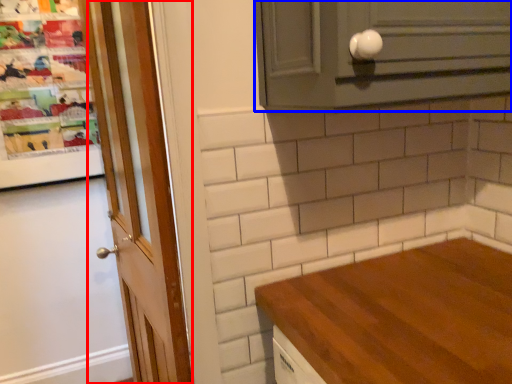
Question: Which object appears farthest to the camera in this image, door (highlighted by a red box) or cabinetry (highlighted by a blue box)?

Choices:
 (A) door
 (B) cabinetry

Answer: (A)